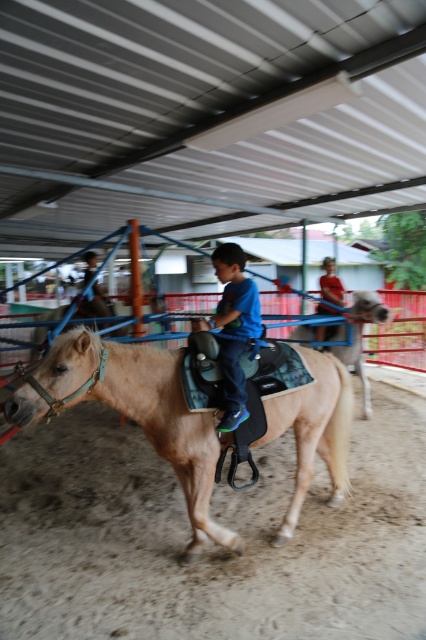
Question: Can you confirm if blue matte shirt at center is positioned below light brown leather jacket at center?

Choices:
 (A) yes
 (B) no

Answer: (A)

Question: Can you confirm if blue matte shirt at center is positioned below light brown leather horse at center?

Choices:
 (A) yes
 (B) no

Answer: (B)

Question: Which of these objects is positioned closest to the light brown leather horse at center?

Choices:
 (A) light brown leather jacket at center
 (B) blue matte shirt at center

Answer: (A)

Question: Is blue matte shirt at center wider than light brown leather horse at center?

Choices:
 (A) yes
 (B) no

Answer: (B)

Question: Which of these objects is positioned closest to the light brown leather horse at center?

Choices:
 (A) light brown leather jacket at center
 (B) light brown leather saddle at center
 (C) blue matte shirt at center

Answer: (A)

Question: Estimate the real-world distances between objects in this image. Which object is farther from the light brown leather jacket at center?

Choices:
 (A) blue matte shirt at center
 (B) light brown leather saddle at center

Answer: (B)